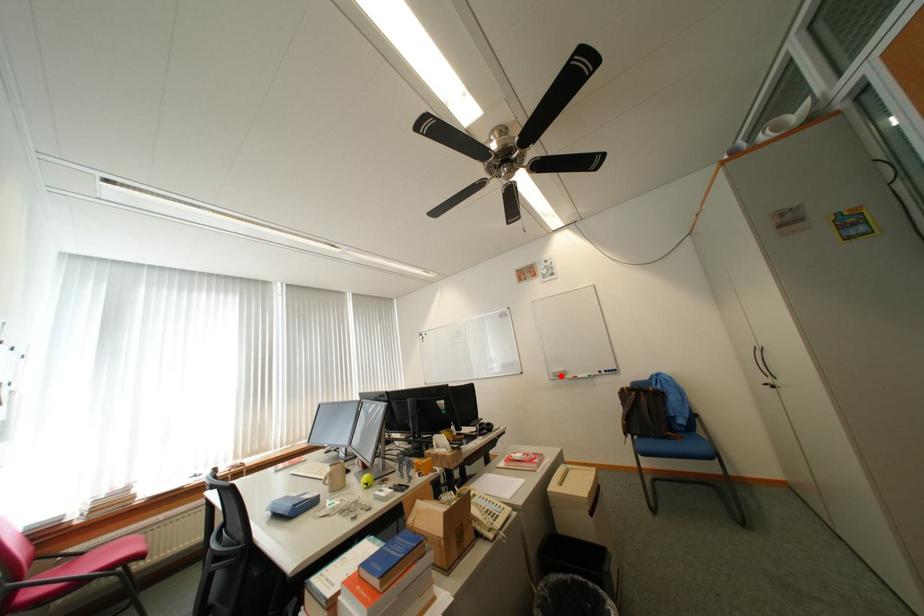
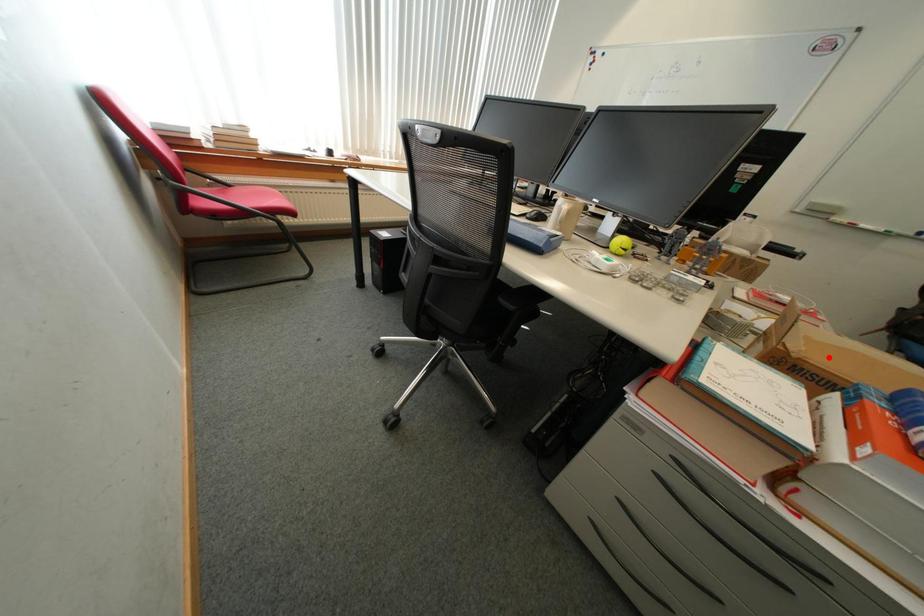
I am providing you with two images of the same scene from different viewpoints. A red point is marked on the first image and another point is marked on the second image. Are the points marked in image1 and image2 representing the same 3D position?

No